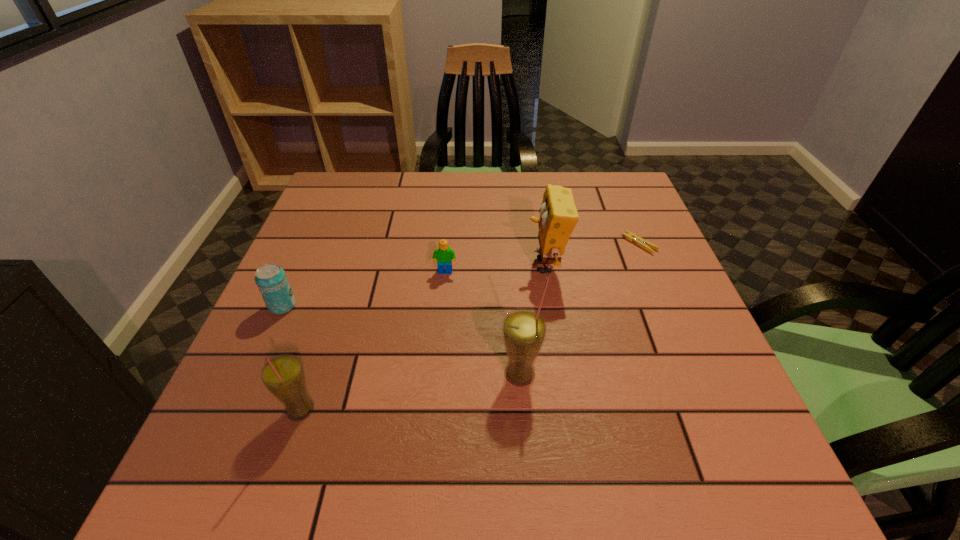
Locate an element on the screen. vacant area located on the back of the farther straw for drinking is located at coordinates (512, 274).

I want to click on free point located 0.240m on the face of the third object from left to right, so click(438, 361).

This screenshot has width=960, height=540. Find the location of `vacant region located 0.100m on the front of the beer can`. vacant region located 0.100m on the front of the beer can is located at coordinates (261, 354).

The width and height of the screenshot is (960, 540). What are the coordinates of `free space located 0.120m on the face of the sponge` in the screenshot? It's located at (476, 265).

Locate an element on the screen. free region located on the face of the sponge is located at coordinates (384, 265).

Image resolution: width=960 pixels, height=540 pixels. What are the coordinates of `vacant point located 0.300m on the face of the sponge` in the screenshot? It's located at (400, 265).

At what (x,y) coordinates should I click in order to perform the action: click on free space located 0.210m on the left of the clothespin. Please return your answer as a coordinate pair (x, y). Looking at the image, I should click on (541, 244).

Image resolution: width=960 pixels, height=540 pixels. Find the location of `straw for drinking that is positioned at the left edge`. straw for drinking that is positioned at the left edge is located at coordinates (283, 376).

Find the location of a particular element. This screenshot has height=540, width=960. beer can that is at the left edge is located at coordinates [x=271, y=280].

At what (x,y) coordinates should I click in order to perform the action: click on object present at the right edge. Please return your answer as a coordinate pair (x, y). The image size is (960, 540). Looking at the image, I should click on (630, 236).